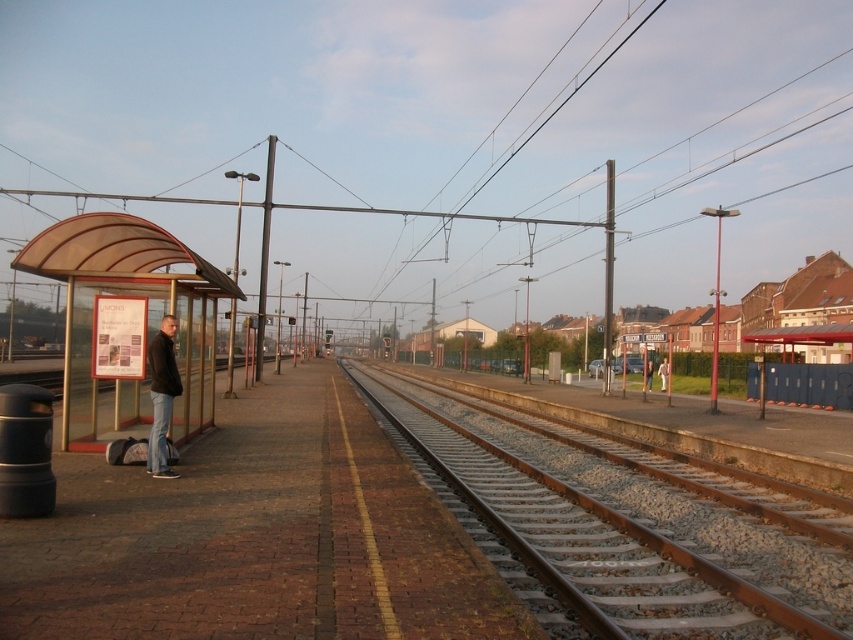
Question: Is light brown leather jacket at center closer to the viewer compared to dark blue jeans at center?

Choices:
 (A) yes
 (B) no

Answer: (B)

Question: Among these objects, which one is nearest to the camera?

Choices:
 (A) light brown leather jacket at center
 (B) dark brown leather jacket at left
 (C) dark blue jeans at center

Answer: (B)

Question: Is rusty metal track at center wider than dark brown leather jacket at left?

Choices:
 (A) yes
 (B) no

Answer: (A)

Question: Which of the following is the closest to the observer?

Choices:
 (A) [x=648, y=385]
 (B) [x=613, y=547]
 (C) [x=213, y=330]

Answer: (B)

Question: Is the position of dark brown leather jacket at left less distant than that of dark blue jeans at center?

Choices:
 (A) yes
 (B) no

Answer: (A)

Question: Which object appears farthest from the camera in this image?

Choices:
 (A) dark blue jeans at center
 (B) rusty metal track at center

Answer: (A)